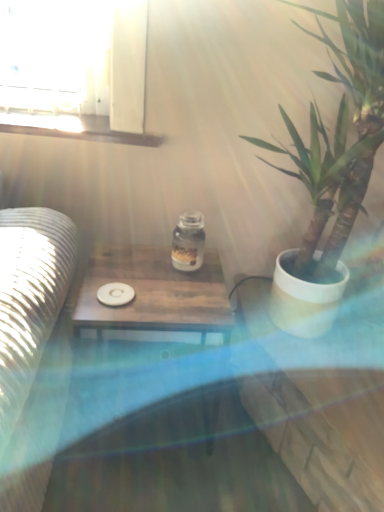
Locate an element on the screen. The image size is (384, 512). unoccupied area behind white matte coaster at center is located at coordinates (130, 272).